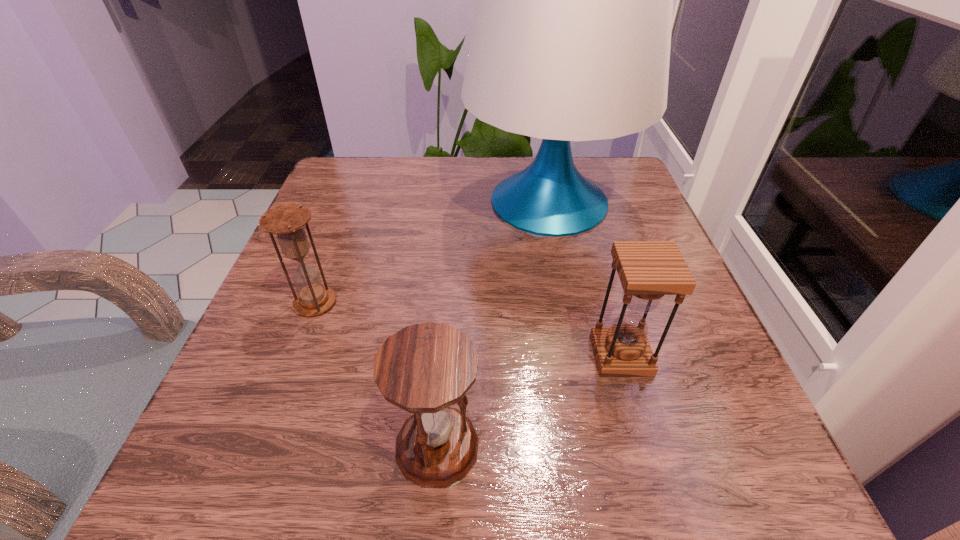
I want to click on table lamp, so click(x=571, y=39).

Locate an element on the screen. the tallest object is located at coordinates (571, 39).

Identify the location of the second farthest hourglass. (648, 270).

Image resolution: width=960 pixels, height=540 pixels. Find the location of `the third farthest object`. the third farthest object is located at coordinates (648, 270).

Locate an element on the screen. the leftmost hourglass is located at coordinates (287, 221).

Locate an element on the screen. Image resolution: width=960 pixels, height=540 pixels. the farthest hourglass is located at coordinates (287, 221).

Find the location of a particular element. This screenshot has width=960, height=540. the nearest hourglass is located at coordinates (425, 368).

Find the location of a particular element. the nearest object is located at coordinates (425, 368).

You are a GUI agent. You are given a task and a screenshot of the screen. Output one action in this format:
    pyautogui.click(x=<x>, y=<y>)
    Task: Click on the vacant space situated 0.330m on the front-facing side of the tallest object
    
    Given the screenshot: What is the action you would take?
    pyautogui.click(x=319, y=202)

The image size is (960, 540). I want to click on vacant point located 0.150m on the front-facing side of the tallest object, so click(398, 202).